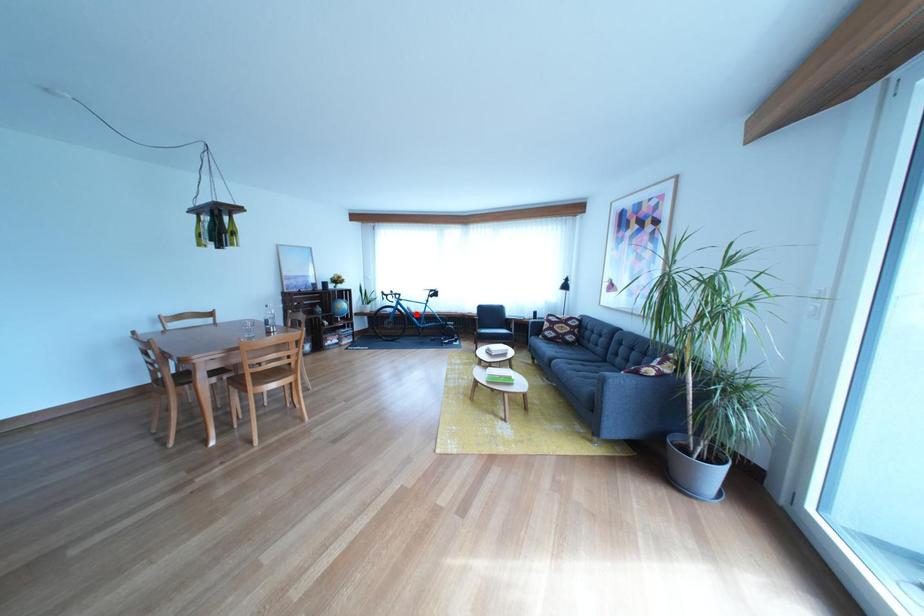
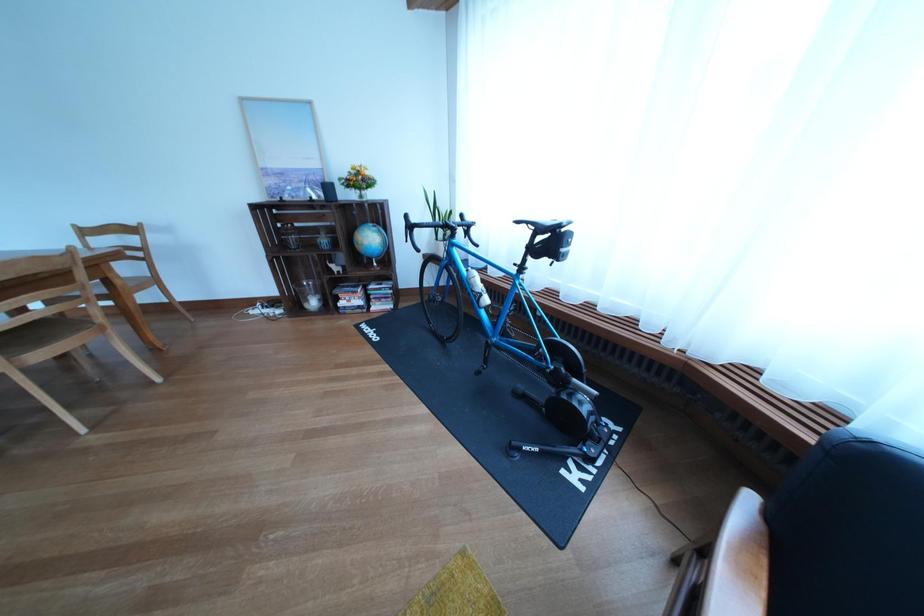
Where in the second image is the point corresponding to the highlighted location from the first image?

(470, 277)